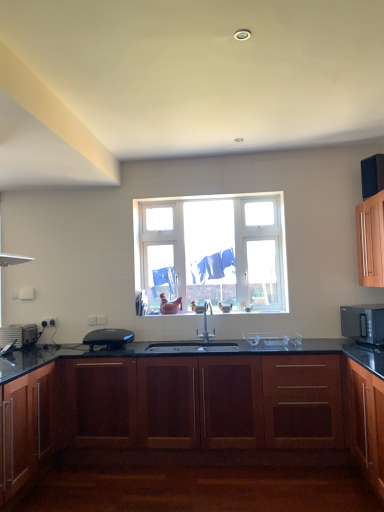
Question: Considering their positions, is silver metallic microwave oven at right located in front of or behind mahogany wood cabinet at lower right, the 2th cabinetry viewed from the right?

Choices:
 (A) behind
 (B) front

Answer: (A)

Question: In the image, is silver metallic microwave oven at right on the left side or the right side of mahogany wood cabinet at lower right, the 2th cabinetry viewed from the right?

Choices:
 (A) right
 (B) left

Answer: (A)

Question: Which object is positioned farthest from the silver metallic microwave oven at right?

Choices:
 (A) mahogany wood cabinet at lower right, positioned as the second cabinetry in left-to-right order
 (B) cabinet at right, the third cabinetry from the left
 (C) silver metallic toaster at left, the second appliance positioned from the right
 (D) mahogany wood cabinet at center, which appears as the 1th cabinetry when viewed from the left
 (E) silver metallic faucet at center

Answer: (C)

Question: Estimate the real-world distances between objects in this image. Which object is farther from the mahogany wood cabinet at center, which ranks as the 3th cabinetry in right-to-left order?

Choices:
 (A) cabinet at right, the third cabinetry from the left
 (B) black plastic toaster at center, which is the 1th appliance in right-to-left order
 (C) silver metallic toaster at left, the second appliance positioned from the right
 (D) clear glass window at center
 (E) silver metallic faucet at center

Answer: (C)